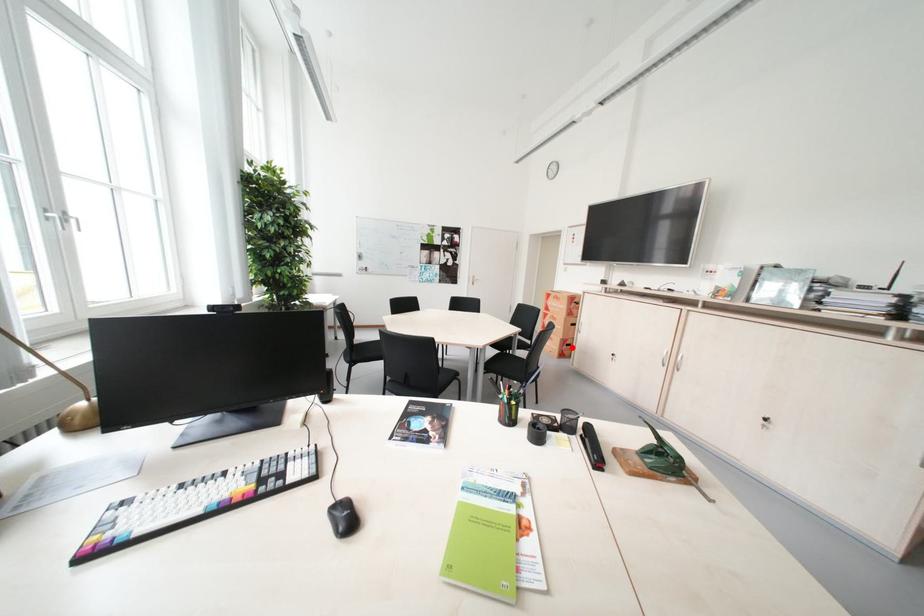
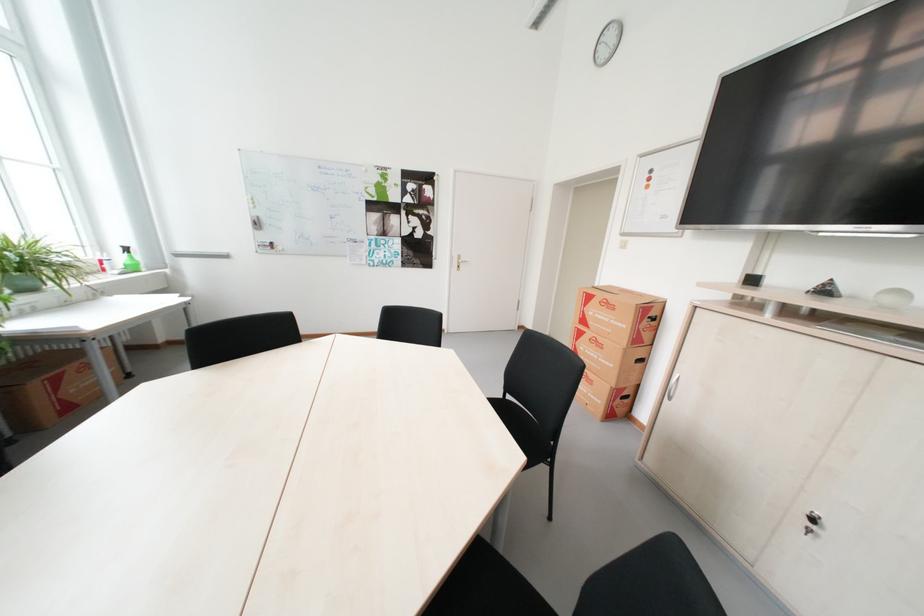
Where in the second image is the point corresponding to the highlighted location from the first image?

(622, 400)